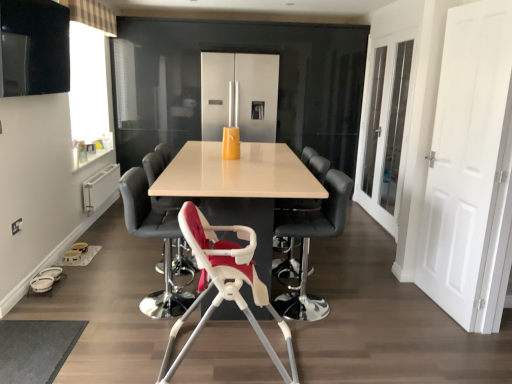
At what (x,y) coordinates should I click in order to perform the action: click on vacant area that lies between white plastic highchair at center, placed as the first chair when sorted from front to back, and matte white table at center. Please return your answer as a coordinate pair (x, y). Looking at the image, I should click on pyautogui.click(x=281, y=354).